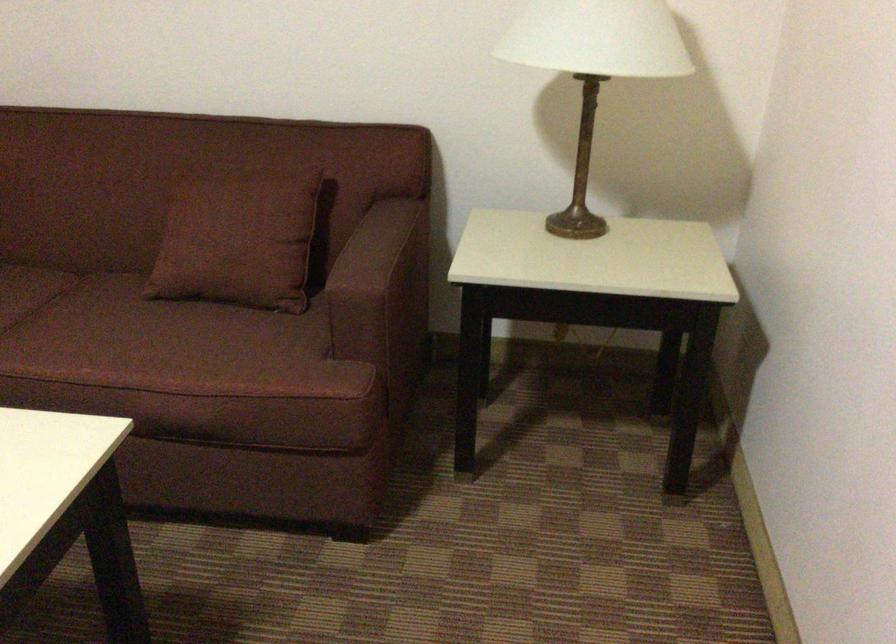
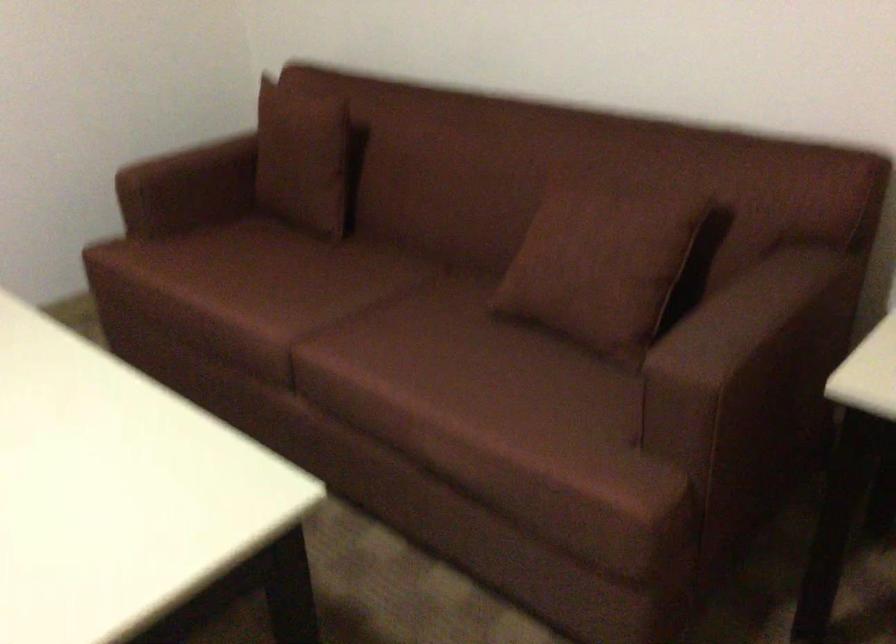
In the second image, find the point that corresponds to (250,232) in the first image.

(600, 263)